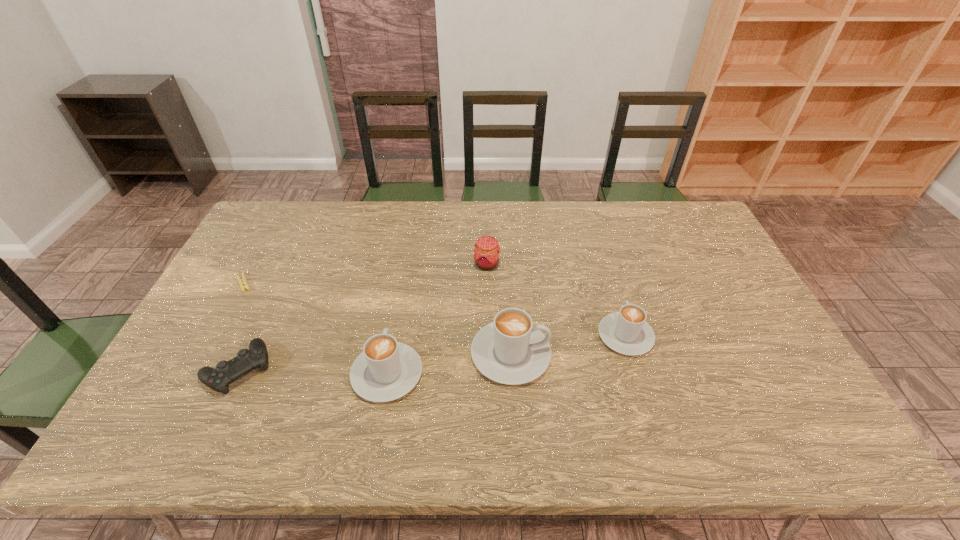
Identify the location of free space that satisfies the following two spatial constraints: 1. to the right of the jam; 2. on the right side of the second tallest object. The height and width of the screenshot is (540, 960). (406, 264).

Identify the location of vacant area in the image that satisfies the following two spatial constraints: 1. to the right of the second tallest cappuccino; 2. on the right side of the jam. (406, 264).